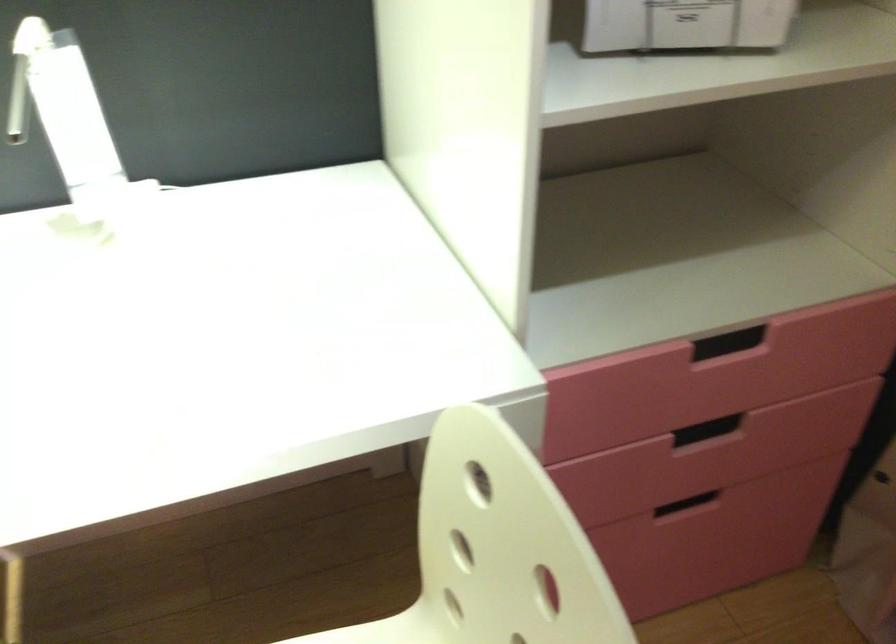
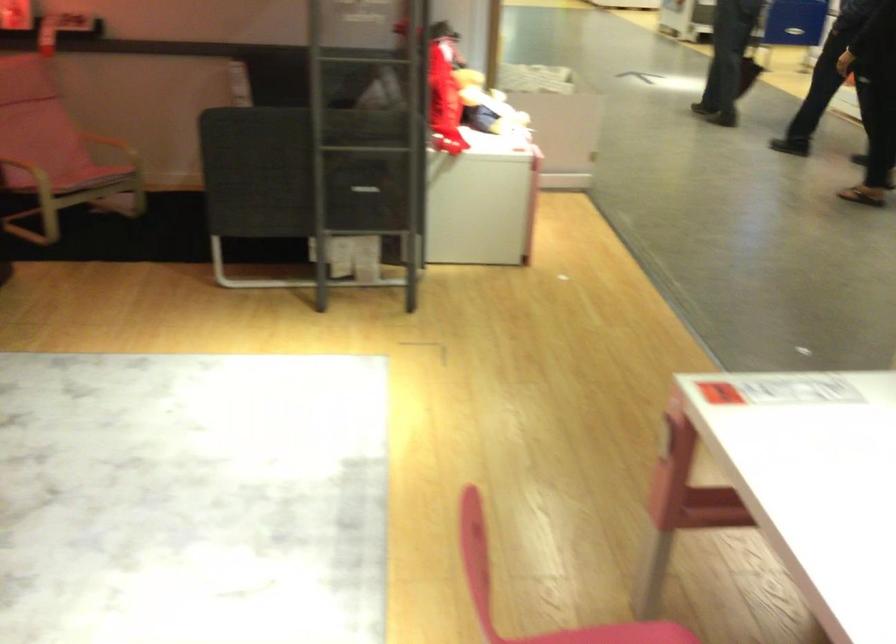
First-person continuous shooting, in which direction is the camera rotating?

The camera's rotation is toward left-down.